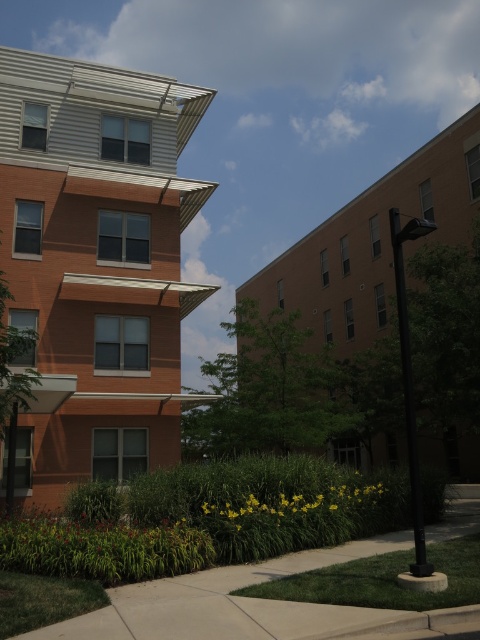
Does orange brick building at left appear on the left side of concrete sidewalk at lower center?

Indeed, orange brick building at left is positioned on the left side of concrete sidewalk at lower center.

Between orange brick building at left and concrete sidewalk at lower center, which one has less height?

concrete sidewalk at lower center

Where is `orange brick building at left`? orange brick building at left is located at coordinates (96, 262).

In order to click on orange brick building at left in this screenshot , I will do `click(96, 262)`.